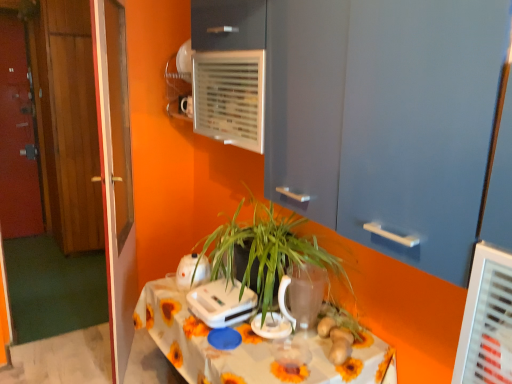
This screenshot has height=384, width=512. Find the location of `free space in front of white glossy kettle at center, which is the 1th appliance in right-to-left order`. free space in front of white glossy kettle at center, which is the 1th appliance in right-to-left order is located at coordinates (265, 363).